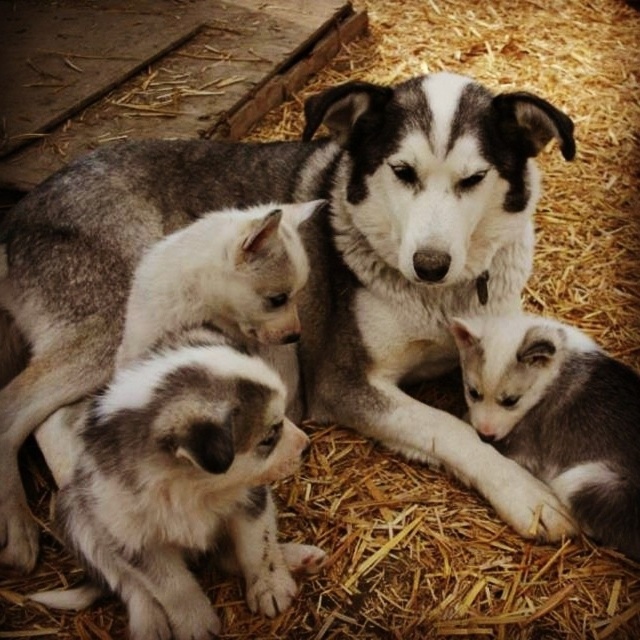
Question: Which of the following is the farthest from the observer?

Choices:
 (A) (566, 333)
 (B) (444, 324)

Answer: (B)

Question: Which of the following is the closest to the observer?

Choices:
 (A) gray and white fur puppy at lower left
 (B) gray and white fur dog at center
 (C) golden straw bed at center
 (D) white fur puppy at center

Answer: (A)

Question: Does gray and white fur dog at center appear on the right side of golden straw bed at center?

Choices:
 (A) no
 (B) yes

Answer: (A)

Question: Which of the following is the farthest from the observer?

Choices:
 (A) gray and white fur puppy at lower left
 (B) gray fur puppy at lower right
 (C) white fur puppy at center

Answer: (B)

Question: Is golden straw bed at center behind white fur puppy at center?

Choices:
 (A) yes
 (B) no

Answer: (A)

Question: Can you confirm if gray and white fur dog at center is positioned to the left of white fur puppy at center?

Choices:
 (A) yes
 (B) no

Answer: (B)